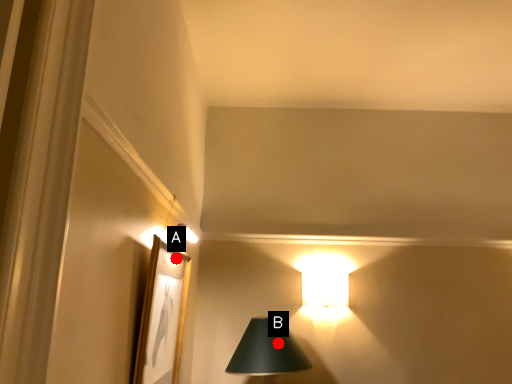
Question: Two points are circled on the image, labeled by A and B beside each circle. Which point is further to the camera?

Choices:
 (A) A is further
 (B) B is further

Answer: (B)